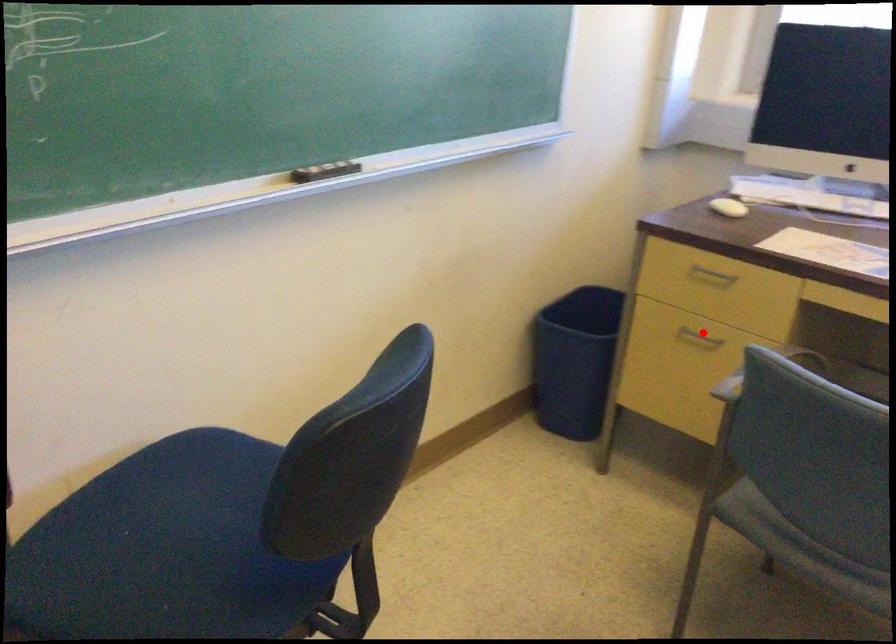
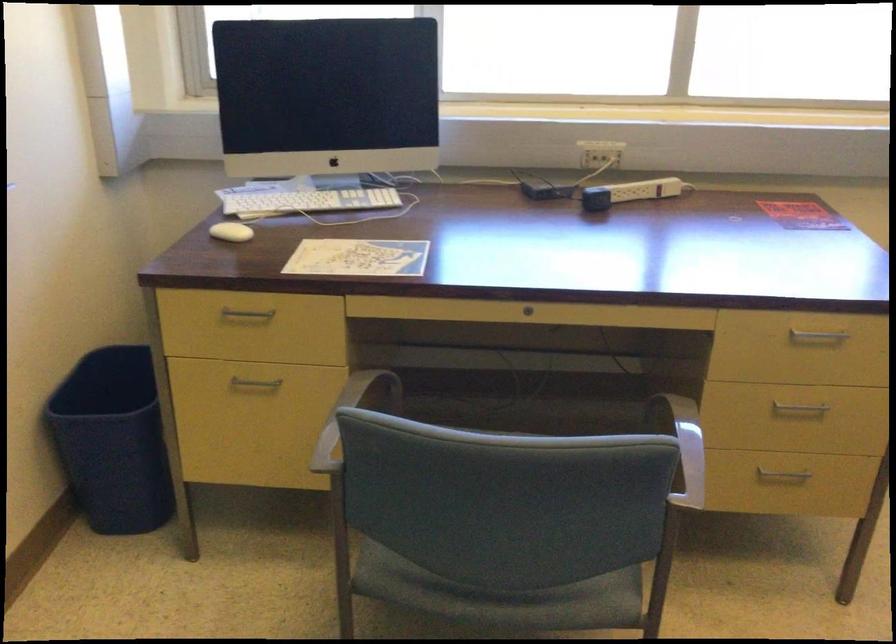
The point at the highlighted location is marked in the first image. Where is the corresponding point in the second image?

(254, 384)